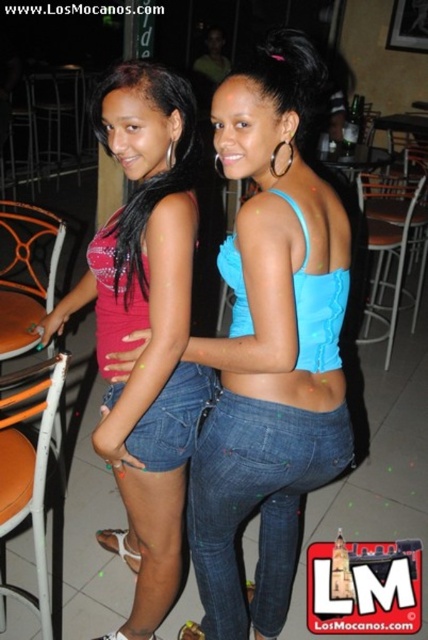
You are standing at the entrance of the venue and want to sit down on the orange metal chair at left. Given that the entrance is at the bottom of the image, can you directly walk straight to the chair without needing to move around other objects or people?

The orange metal chair at left is located at point (x=26, y=273), so yes, you can walk straight from the entrance to the chair as there are no obstacles mentioned in the scene description.

You are a photographer trying to capture a candid shot of the blue denim shorts at center and the metallic silver chair at center. The camera you are using has a maximum focus range of 7 feet. Will you be able to fit both objects into the frame without moving closer or farther away?

The blue denim shorts at center and the metallic silver chair at center are 6.99 feet apart from each other. Since the camera has a maximum focus range of 7 feet, you can fit both objects into the frame without needing to adjust your distance.